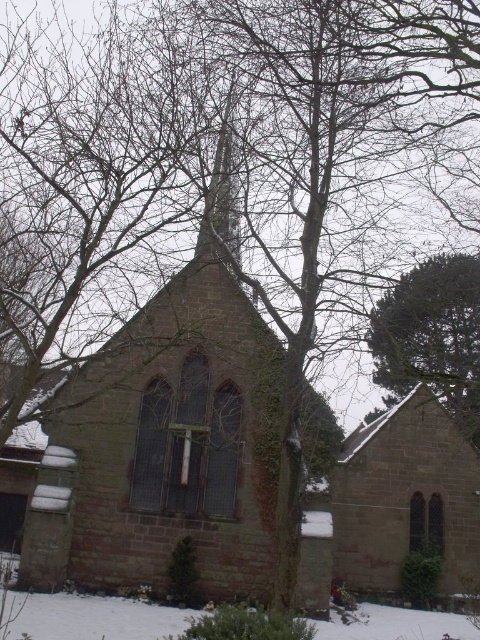
Is green textured pine tree at upper right thinner than smooth stone spire at center?

No, green textured pine tree at upper right is not thinner than smooth stone spire at center.

This screenshot has height=640, width=480. I want to click on green textured pine tree at upper right, so click(432, 336).

Where is `green textured pine tree at upper right`? This screenshot has width=480, height=640. green textured pine tree at upper right is located at coordinates (432, 336).

Does brown stone chapel at center have a larger size compared to smooth stone spire at center?

Correct, brown stone chapel at center is larger in size than smooth stone spire at center.

Between brown stone chapel at center and smooth stone spire at center, which one is positioned lower?

brown stone chapel at center is below.

Is point (236, 292) closer to camera compared to point (210, 237)?

No, (236, 292) is behind (210, 237).

At what (x,y) coordinates should I click in order to perform the action: click on brown stone chapel at center. Please return your answer as a coordinate pair (x, y). The width and height of the screenshot is (480, 640). Looking at the image, I should click on (165, 445).

Image resolution: width=480 pixels, height=640 pixels. Describe the element at coordinates (165, 445) in the screenshot. I see `brown stone chapel at center` at that location.

Identify the location of brown stone chapel at center. This screenshot has height=640, width=480. (165, 445).

Does point (260, 570) come closer to viewer compared to point (380, 378)?

Yes, it is.

Where is `brown stone chapel at center`? brown stone chapel at center is located at coordinates (165, 445).